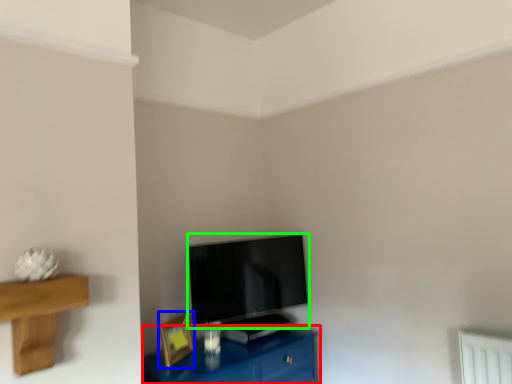
Question: Based on their relative distances, which object is nearer to table (highlighted by a red box)? Choose from picture frame (highlighted by a blue box) and television (highlighted by a green box).

Choices:
 (A) picture frame
 (B) television

Answer: (A)